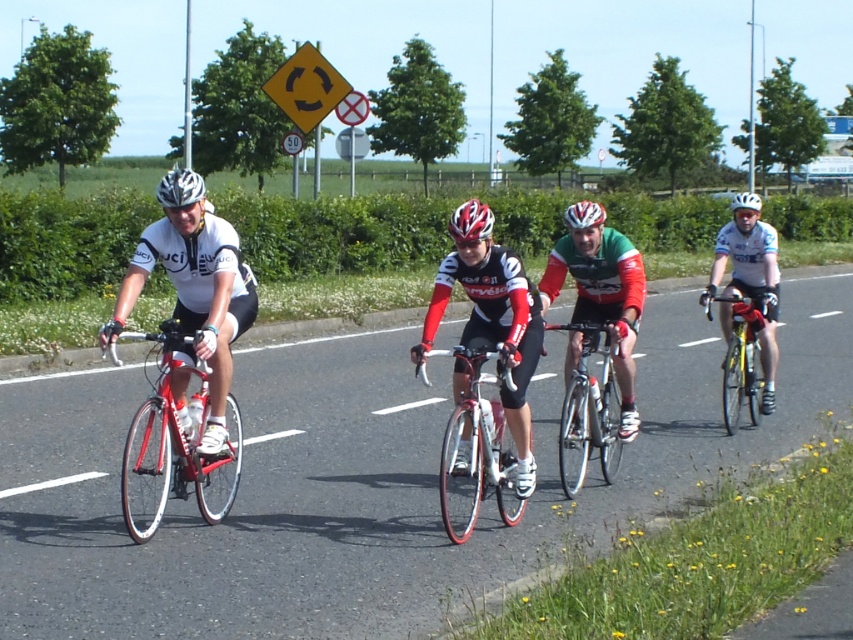
Question: Is white matte bicycle helmet at center closer to the viewer compared to white matte helmet at center?

Choices:
 (A) no
 (B) yes

Answer: (B)

Question: Can you confirm if white glossy bicycle helmet at center is positioned to the left of white matte bicycle helmet at center?

Choices:
 (A) no
 (B) yes

Answer: (B)

Question: Estimate the real-world distances between objects in this image. Which object is farther from the shiny red bicycle at left?

Choices:
 (A) shiny silver bicycle at center
 (B) shiny red frame at center
 (C) yellow plastic diamond at upper center
 (D) white matte bicycle helmet at center

Answer: (C)

Question: Is shiny red bicycle at left positioned behind yellow metallic bicycle at right?

Choices:
 (A) no
 (B) yes

Answer: (A)

Question: Which object is farther from the camera taking this photo?

Choices:
 (A) shiny red bicycle at left
 (B) white glossy bicycle helmet at center
 (C) white matte bicycle helmet at center
 (D) yellow metallic bicycle at right

Answer: (D)

Question: Among these objects, which one is nearest to the camera?

Choices:
 (A) yellow plastic diamond at upper center
 (B) white matte bicycle helmet at center

Answer: (B)